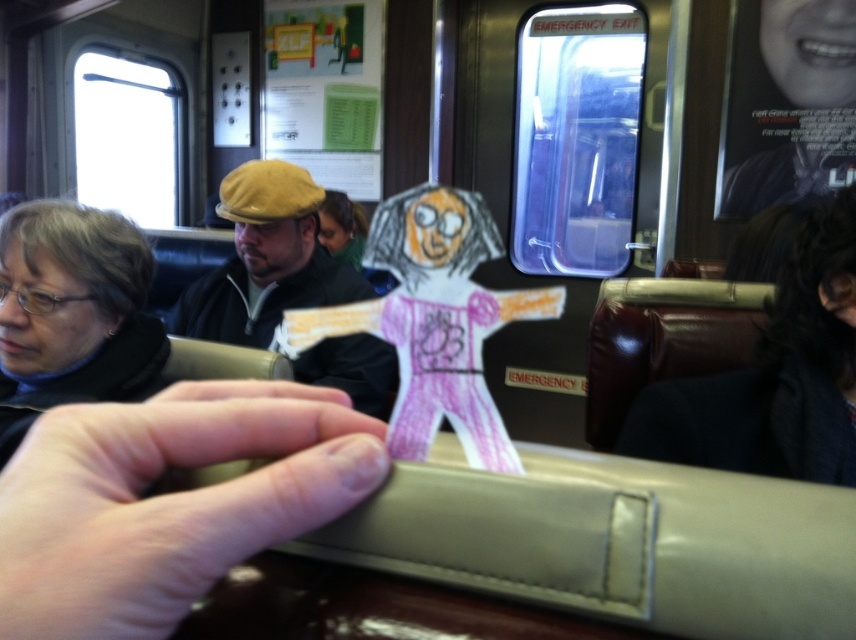
Question: Considering the relative positions of pink flesh-toned hand at center and matte black jacket at left in the image provided, where is pink flesh-toned hand at center located with respect to matte black jacket at left?

Choices:
 (A) above
 (B) below

Answer: (B)

Question: Which of the following is the closest to the observer?

Choices:
 (A) (337, 355)
 (B) (68, 614)

Answer: (B)

Question: Based on their relative distances, which object is farther from the matte black jacket at center?

Choices:
 (A) matte black jacket at left
 (B) pink flesh-toned hand at center

Answer: (B)

Question: Is pink flesh-toned hand at center to the right of matte black jacket at center from the viewer's perspective?

Choices:
 (A) no
 (B) yes

Answer: (B)

Question: Can you confirm if matte black jacket at left is positioned to the right of matte black jacket at center?

Choices:
 (A) no
 (B) yes

Answer: (A)

Question: Which point is farther to the camera?

Choices:
 (A) matte black jacket at center
 (B) pink flesh-toned hand at center

Answer: (A)